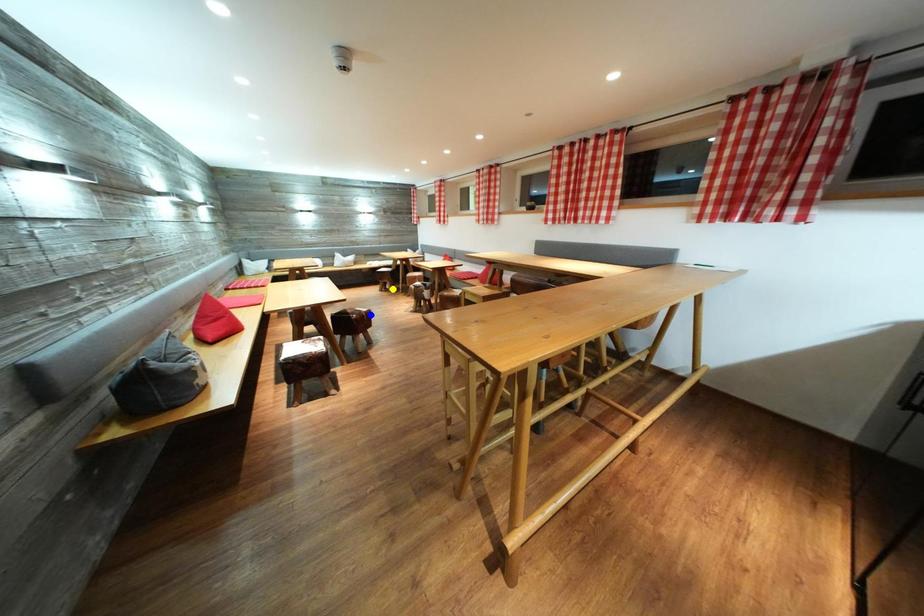
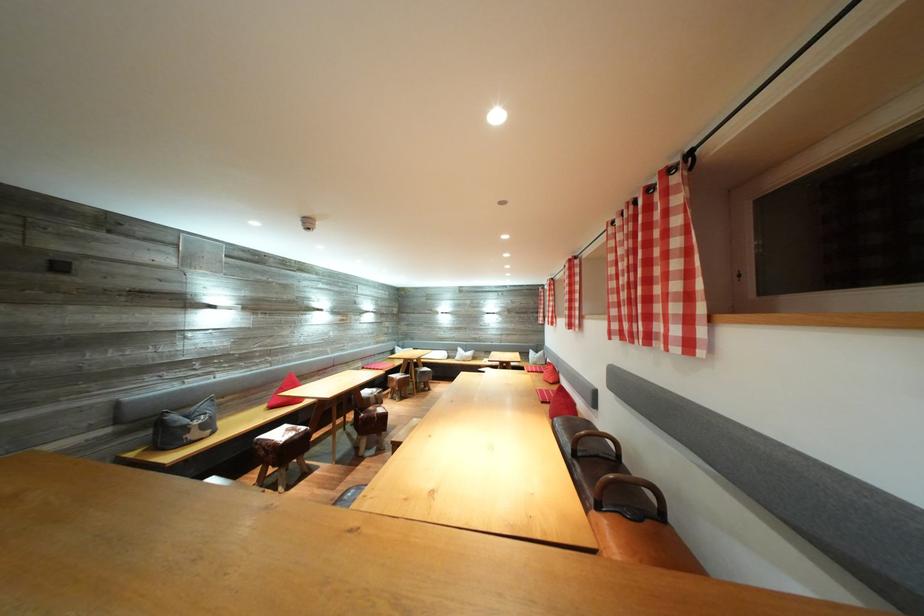
I am providing you with two images of the same scene from different viewpoints. Three points are marked in image1. Which point corresponds to a part or object that is occluded in image2?In image1, three points are marked. Which of them correspond to a part or object that is occluded in image2?Among the three points shown in image1, which one corresponds to a part or object that is no longer visible due to occlusion in image2?

Invisible in image2: green point, yellow point.